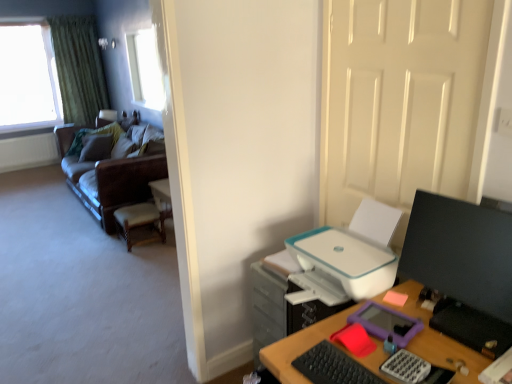
Question: Considering the relative sizes of black matte keyboard at lower right and pink matte sticky notes at right in the image provided, is black matte keyboard at lower right taller than pink matte sticky notes at right?

Choices:
 (A) no
 (B) yes

Answer: (B)

Question: Is black matte keyboard at lower right wider than pink matte sticky notes at right?

Choices:
 (A) no
 (B) yes

Answer: (B)

Question: Considering the relative sizes of black matte keyboard at lower right and pink matte sticky notes at right in the image provided, is black matte keyboard at lower right smaller than pink matte sticky notes at right?

Choices:
 (A) yes
 (B) no

Answer: (B)

Question: Considering the relative sizes of black matte keyboard at lower right and pink matte sticky notes at right in the image provided, is black matte keyboard at lower right shorter than pink matte sticky notes at right?

Choices:
 (A) no
 (B) yes

Answer: (A)

Question: From a real-world perspective, is black matte keyboard at lower right located higher than pink matte sticky notes at right?

Choices:
 (A) no
 (B) yes

Answer: (B)

Question: From their relative heights in the image, would you say black glossy monitor at right is taller or shorter than white plastic file cabinet at lower right?

Choices:
 (A) short
 (B) tall

Answer: (A)

Question: Looking at the image, does black glossy monitor at right seem bigger or smaller compared to white plastic file cabinet at lower right?

Choices:
 (A) big
 (B) small

Answer: (B)

Question: Is black glossy monitor at right wider or thinner than white plastic file cabinet at lower right?

Choices:
 (A) wide
 (B) thin

Answer: (B)

Question: Considering the positions of point (488, 256) and point (253, 337), is point (488, 256) closer or farther from the camera than point (253, 337)?

Choices:
 (A) farther
 (B) closer

Answer: (B)

Question: From the image's perspective, is wooden woven seat at left positioned above or below pink matte sticky notes at right?

Choices:
 (A) above
 (B) below

Answer: (A)

Question: Is point (163, 235) closer or farther from the camera than point (393, 296)?

Choices:
 (A) farther
 (B) closer

Answer: (A)

Question: Visually, is wooden woven seat at left positioned to the left or to the right of pink matte sticky notes at right?

Choices:
 (A) right
 (B) left

Answer: (B)

Question: Is wooden woven seat at left in front of or behind pink matte sticky notes at right in the image?

Choices:
 (A) front
 (B) behind

Answer: (B)

Question: From the image's perspective, is brown leather couch at left located above or below black matte keyboard at lower right?

Choices:
 (A) below
 (B) above

Answer: (B)

Question: From a real-world perspective, is brown leather couch at left physically located above or below black matte keyboard at lower right?

Choices:
 (A) above
 (B) below

Answer: (B)